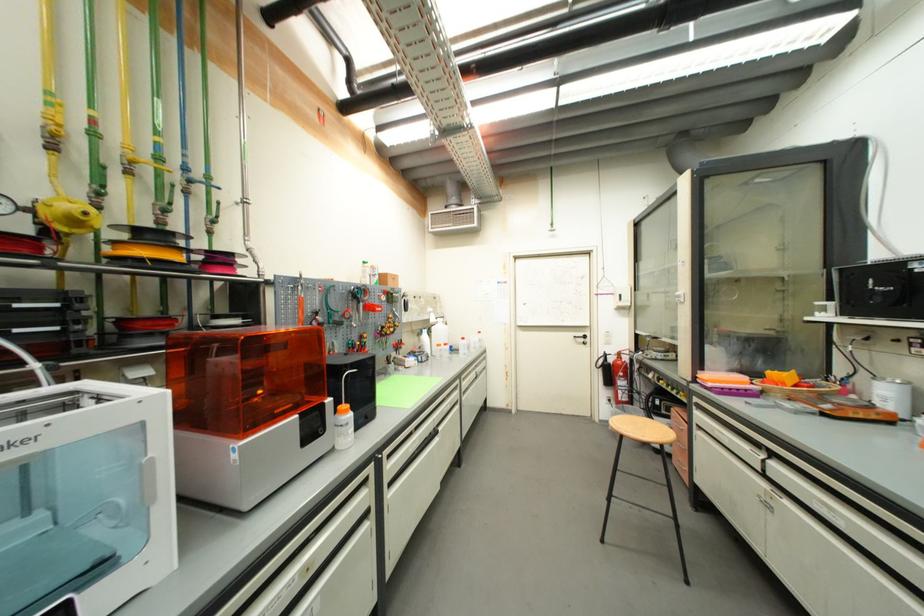
This screenshot has height=616, width=924. Describe the element at coordinates (633, 390) in the screenshot. I see `a fire extinguisher handle` at that location.